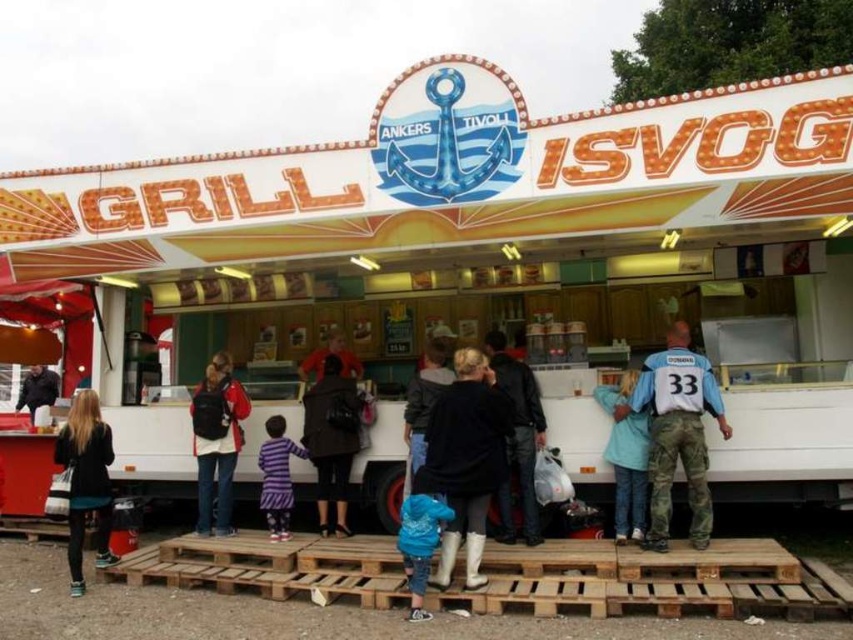
Question: Is black leather jacket at lower left to the left of blue rubber boots at lower center from the viewer's perspective?

Choices:
 (A) no
 (B) yes

Answer: (B)

Question: Observing the image, what is the correct spatial positioning of dark gray jacket at center in reference to purple striped dress at center?

Choices:
 (A) above
 (B) below

Answer: (A)

Question: Which is nearer to the dark gray jacket at center?

Choices:
 (A) purple striped dress at center
 (B) black leather jacket at lower left

Answer: (A)

Question: From the image, what is the correct spatial relationship of black matte jacket at center in relation to matte black backpack at center?

Choices:
 (A) above
 (B) below

Answer: (A)

Question: Which object is the farthest from the blue rubber boots at lower center?

Choices:
 (A) purple striped dress at center
 (B) matte black backpack at center
 (C) white jersey at center

Answer: (B)

Question: Which point is farther to the camera?

Choices:
 (A) white plastic food truck at center
 (B) purple striped dress at center
 (C) dark brown leather jacket at center
 (D) dark brown leather jacket at lower left

Answer: (D)